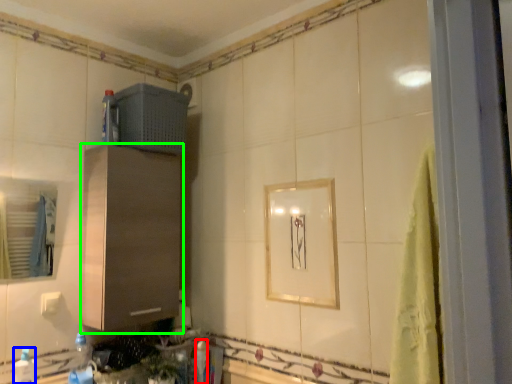
Question: Which object is the farthest from bottle (highlighted by a red box)? Choose among these: bottle (highlighted by a blue box) or cabinetry (highlighted by a green box).

Choices:
 (A) bottle
 (B) cabinetry

Answer: (A)